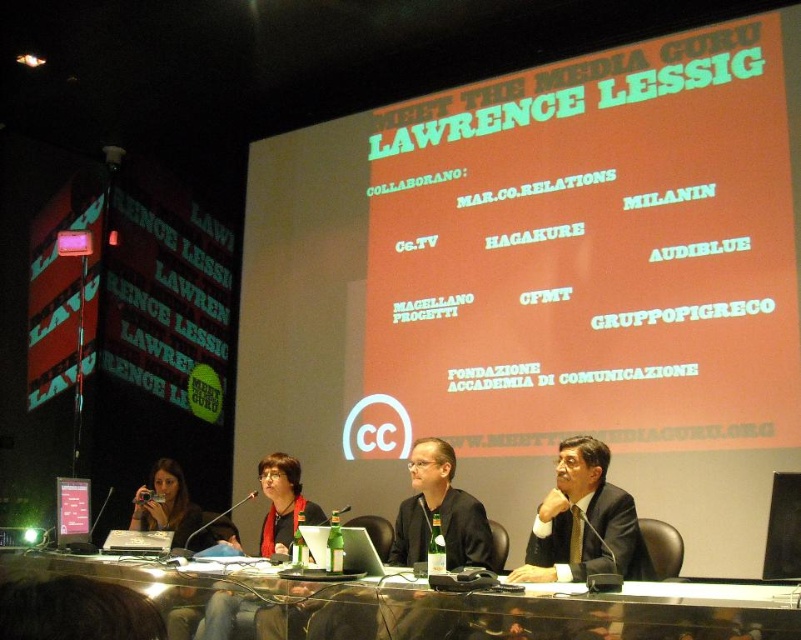
You are a photographer adjusting your camera to capture the panel discussion setup. You notice two points marked in the scene at coordinates point (457,634) and point (147,548). Which point should you focus on first to ensure both points are in sharp focus?

You should focus on point (457,634) first because it is closer to the camera than point (147,548), ensuring the depth of field captures both points clearly.

You are an event organizer who needs to adjust the microphone stand between the black suit at center and the silver metallic laptop at center. Since the microphone stand is 1.5 meters tall, will it be too tall for the space between them?

The black suit at center has a greater height compared to the silver metallic laptop at center. Since the microphone stand is 1.5 meters tall, it may be too tall if the space between them is shorter than 1.5 meters. However, the height of the objects themselves doesn